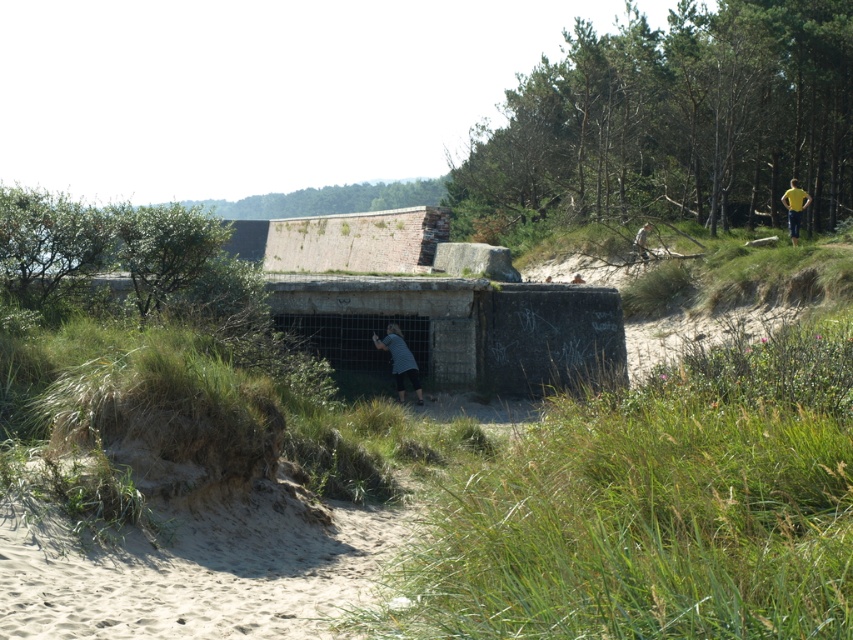
Does gray striped shirt at center have a larger size compared to yellow shirt at upper right?

Actually, gray striped shirt at center might be smaller than yellow shirt at upper right.

You are a GUI agent. You are given a task and a screenshot of the screen. Output one action in this format:
    pyautogui.click(x=<x>, y=<y>)
    Task: Click on the gray striped shirt at center
    
    Given the screenshot: What is the action you would take?
    (399, 360)

What do you see at coordinates (793, 208) in the screenshot? I see `yellow fabric shirt at upper right` at bounding box center [793, 208].

What do you see at coordinates (793, 208) in the screenshot? The height and width of the screenshot is (640, 853). I see `yellow fabric shirt at upper right` at bounding box center [793, 208].

In order to click on yellow fabric shirt at upper right in this screenshot , I will do `click(793, 208)`.

Is the position of gray striped shirt at center more distant than that of yellow fabric shirt at upper right?

No, it is not.

Can you confirm if gray striped shirt at center is bigger than yellow fabric shirt at upper right?

No, gray striped shirt at center is not bigger than yellow fabric shirt at upper right.

Who is more forward, (396, 371) or (788, 228)?

Point (396, 371) is more forward.

Find the location of a particular element. Image resolution: width=853 pixels, height=640 pixels. gray striped shirt at center is located at coordinates (399, 360).